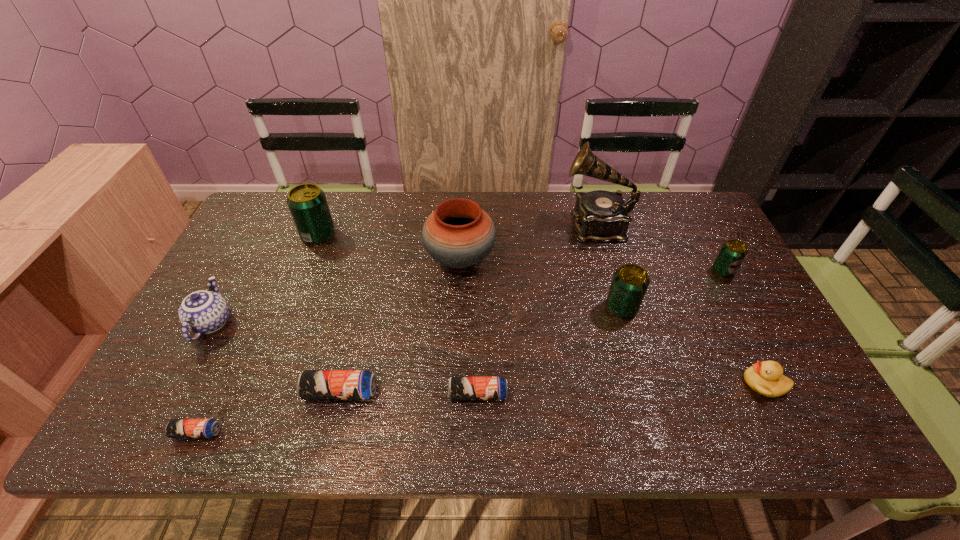
Where is `green beer can that is the second nearest to the second farthest green beer can`? green beer can that is the second nearest to the second farthest green beer can is located at coordinates (307, 203).

Locate which green beer can ranks in proximity to the duckling. Please provide its 2D coordinates. Your answer should be formatted as a tuple, i.e. [(x, y)], where the tuple contains the x and y coordinates of a point satisfying the conditions above.

[(630, 282)]

Find the location of a particular element. This screenshot has height=540, width=960. blue beer can that is the second closest to the biggest green beer can is located at coordinates (176, 428).

Image resolution: width=960 pixels, height=540 pixels. Identify the location of blue beer can object that ranks as the second closest to the third farthest beer can. (312, 384).

Locate an element on the screen. free space in the image that satisfies the following two spatial constraints: 1. at the spout of the smallest green beer can; 2. on the right side of the blue chinaware is located at coordinates (239, 271).

The height and width of the screenshot is (540, 960). In order to click on vacant region that satisfies the following two spatial constraints: 1. on the front-facing side of the yellow duckling; 2. on the front side of the third shortest beer can in this screenshot , I will do `click(768, 392)`.

Image resolution: width=960 pixels, height=540 pixels. I want to click on blank area in the image that satisfies the following two spatial constraints: 1. on the back side of the second shortest object; 2. on the right side of the second farthest beer can, so click(478, 271).

Find the location of a particular element. This screenshot has height=540, width=960. vacant area that satisfies the following two spatial constraints: 1. on the front-facing side of the yellow duckling; 2. on the front side of the seventh object from right to left is located at coordinates (768, 392).

Locate an element on the screen. This screenshot has height=540, width=960. free location that satisfies the following two spatial constraints: 1. on the back side of the nearest blue beer can; 2. on the left side of the leftmost green beer can is located at coordinates (288, 235).

The height and width of the screenshot is (540, 960). I want to click on vacant point that satisfies the following two spatial constraints: 1. on the front side of the fifth shortest beer can; 2. on the right side of the farthest green beer can, so click(290, 308).